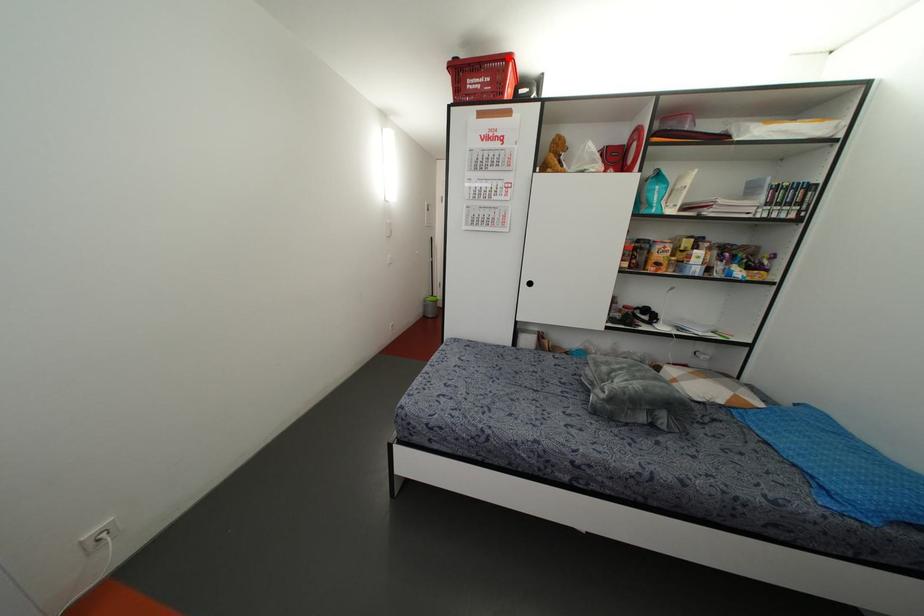
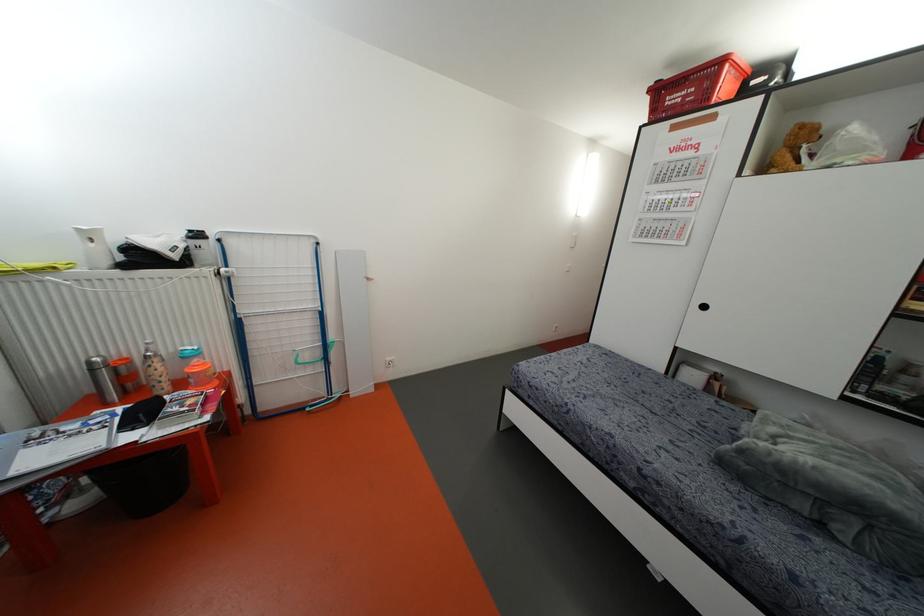
In the second image, find the point that corresponds to the highlighted location in the first image.

(723, 60)